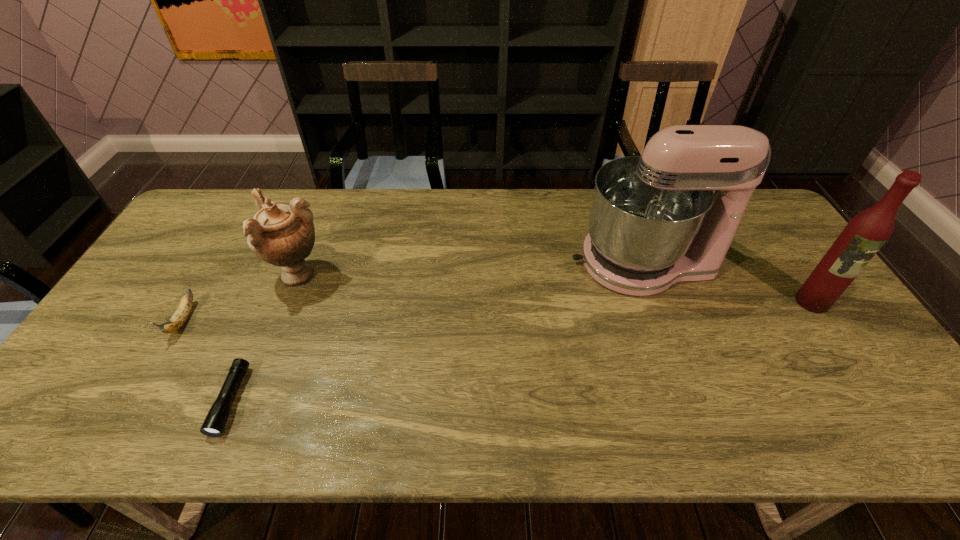
This screenshot has width=960, height=540. Identify the location of free space between the liquor and the leftmost object. (497, 311).

Identify the location of vacant region between the flashlight and the liquor. (521, 351).

Locate which object is the third closest to the rightmost object. Please provide its 2D coordinates. Your answer should be formatted as a tuple, i.e. [(x, y)], where the tuple contains the x and y coordinates of a point satisfying the conditions above.

[(216, 419)]

Point out which object is positioned as the nearest to the third shortest object. Please provide its 2D coordinates. Your answer should be formatted as a tuple, i.e. [(x, y)], where the tuple contains the x and y coordinates of a point satisfying the conditions above.

[(178, 319)]

Where is `vacant space that satisfies the following two spatial constraints: 1. on the front-facing side of the mixer; 2. at the lens end of the nearest object`? vacant space that satisfies the following two spatial constraints: 1. on the front-facing side of the mixer; 2. at the lens end of the nearest object is located at coordinates (694, 400).

You are a GUI agent. You are given a task and a screenshot of the screen. Output one action in this format:
    pyautogui.click(x=<x>, y=<y>)
    Task: Click on the free spot that satisfies the following two spatial constraints: 1. on the front-facing side of the mixer; 2. on the peel of the leftmost object
    The height and width of the screenshot is (540, 960).
    Given the screenshot: What is the action you would take?
    pyautogui.click(x=664, y=320)